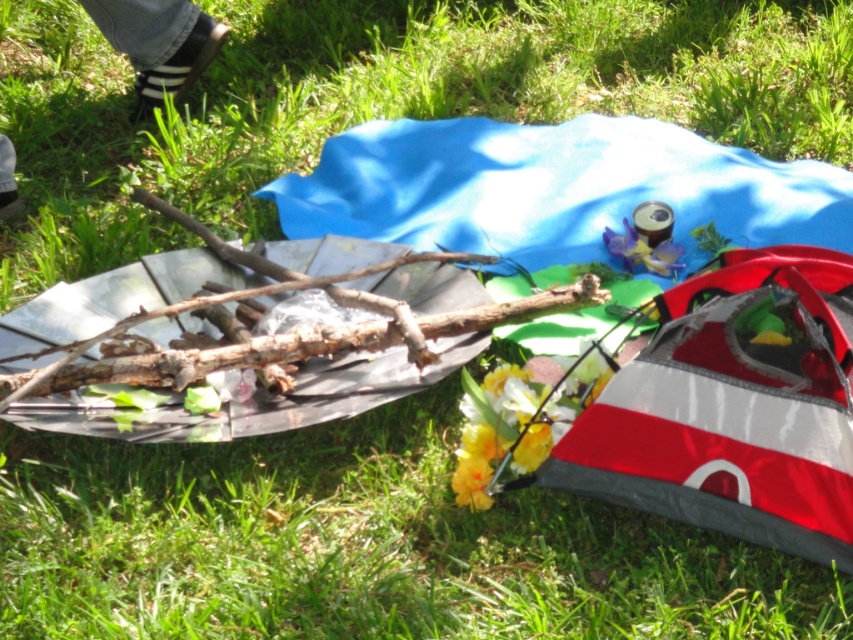
You are planning to place a small decorative item on the grassy area between the yellow artificial flower at center and the yellow matte flower at center. Which flower should you place it closer to if you want the item to be closer to the larger one?

You should place the item closer to the yellow artificial flower at center because it is larger than the yellow matte flower at center.

You are standing at the center of the image. Which object is located at the coordinates point (158,42)?

The black leather shoe at upper left is located at point (158,42).

You are a person who wants to place a small decorative item on the grassy area between the black leather shoe at upper left and the yellow matte flower at center. Based on their heights, which object should you place the item closer to to ensure it doesn

The black leather shoe at upper left is much taller than the yellow matte flower at center, so placing the item closer to the yellow matte flower at center would ensure it is less likely to be obscured by the taller shoe.